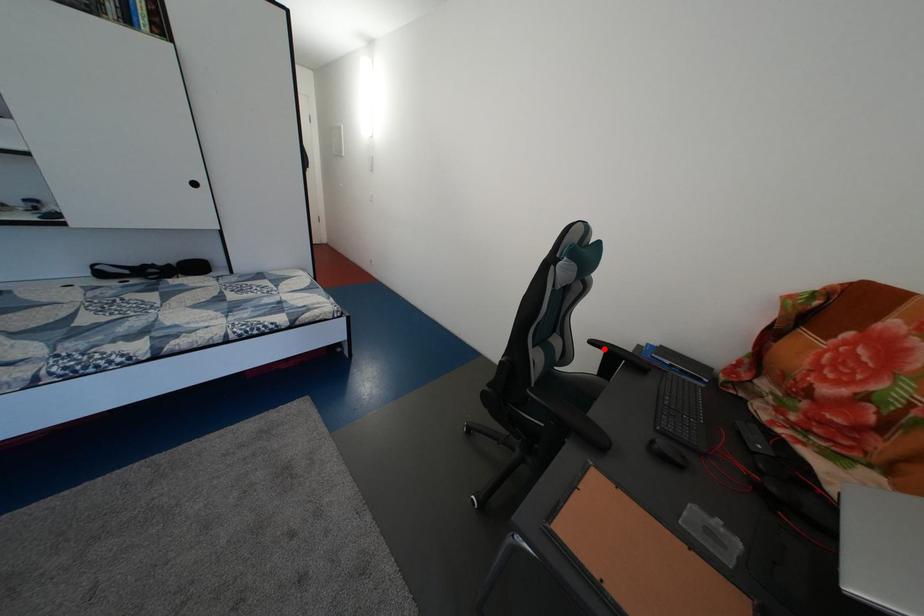
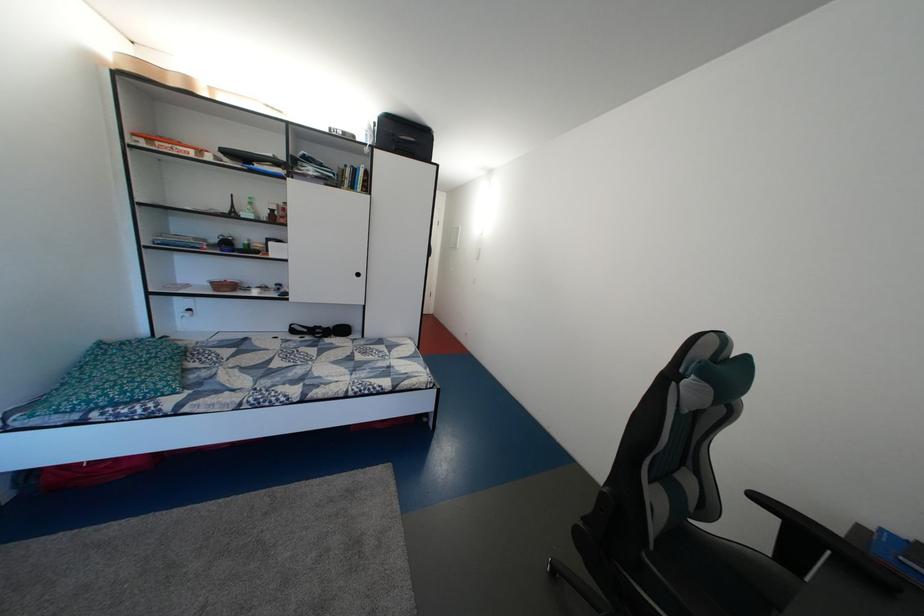
Find the pixel in the second image that matches the highlighted location in the first image.

(768, 504)